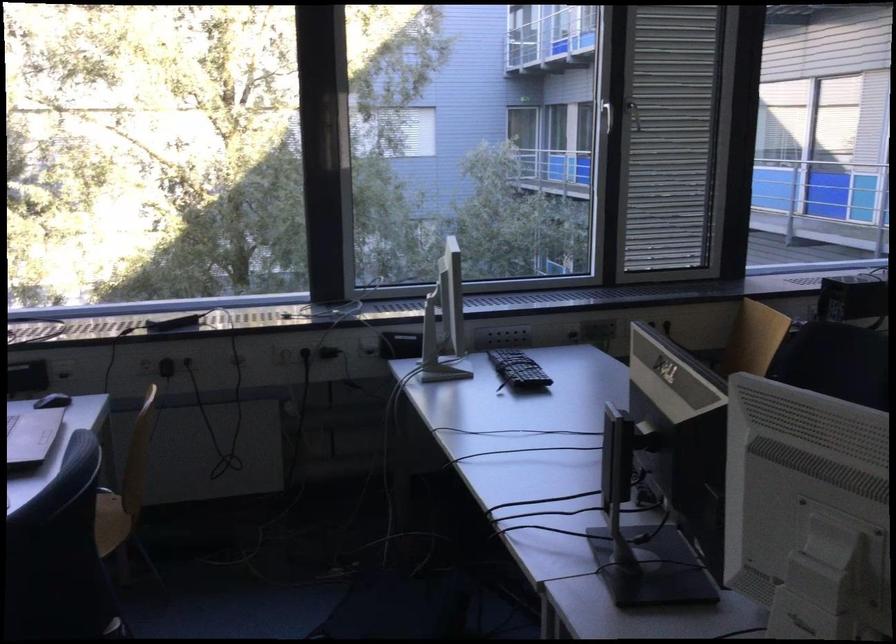
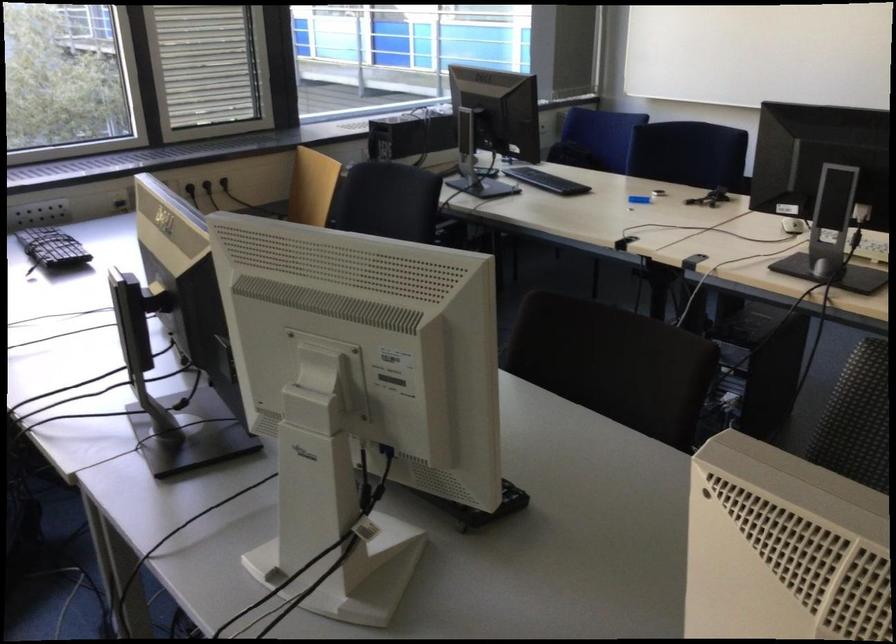
In the second image, find the point that corresponds to point (750, 337) in the first image.

(312, 187)